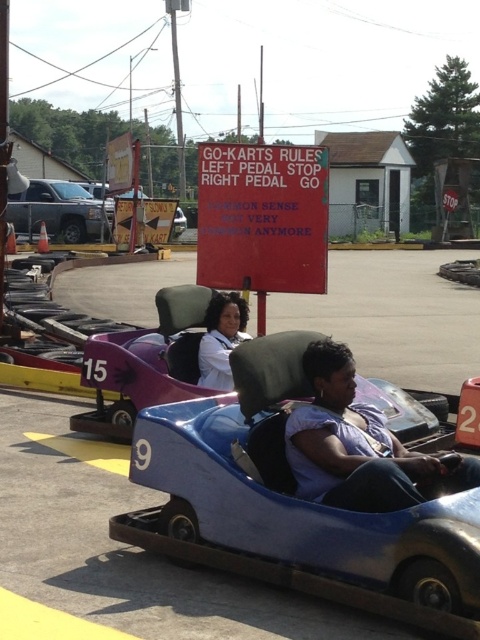
Measure the distance between metallic blue go-kart at center and purple matte shirt at center.

metallic blue go-kart at center and purple matte shirt at center are 17.60 centimeters apart from each other.

I want to click on metallic blue go-kart at center, so click(310, 499).

Is point (414, 556) behind point (381, 476)?

That is False.

Locate an element on the screen. This screenshot has width=480, height=640. metallic blue go-kart at center is located at coordinates (310, 499).

Who is positioned more to the right, metallic blue go-kart at center or silver metallic truck at left?

From the viewer's perspective, metallic blue go-kart at center appears more on the right side.

Is metallic blue go-kart at center to the right of silver metallic truck at left from the viewer's perspective?

Indeed, metallic blue go-kart at center is positioned on the right side of silver metallic truck at left.

I want to click on metallic blue go-kart at center, so click(310, 499).

Find the location of a particular element. metallic blue go-kart at center is located at coordinates (310, 499).

Does metallic blue go-kart at center have a lesser height compared to white matte jacket at center?

Incorrect, metallic blue go-kart at center's height does not fall short of white matte jacket at center's.

Is metallic blue go-kart at center taller than white matte jacket at center?

Yes, metallic blue go-kart at center is taller than white matte jacket at center.

Is point (382, 509) in front of point (222, 317)?

Yes, point (382, 509) is in front of point (222, 317).

Locate an element on the screen. metallic blue go-kart at center is located at coordinates (310, 499).